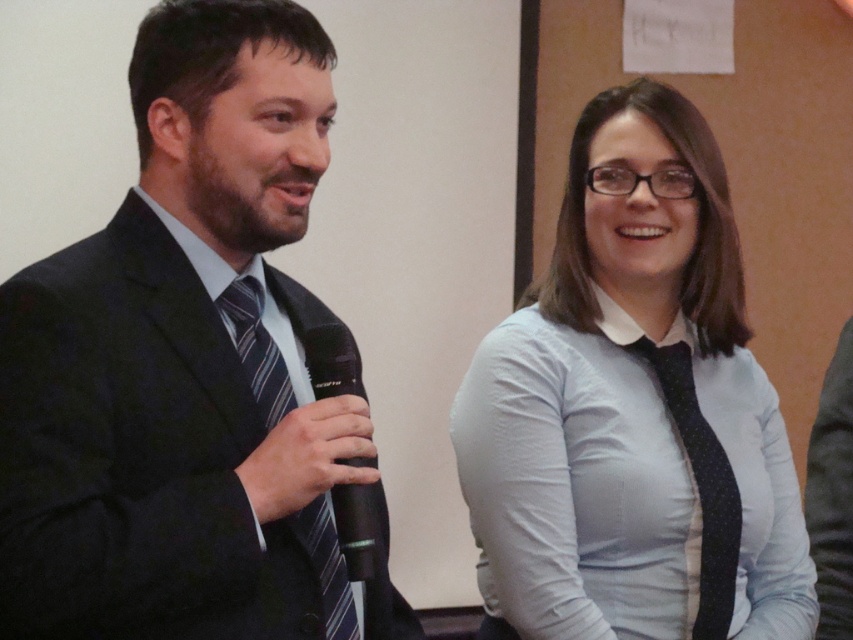
Question: Which object is positioned closest to the black dotted tie at center?

Choices:
 (A) striped fabric tie at left
 (B) light blue shirt at center
 (C) black plastic microphone at center
 (D) matte black suit at left

Answer: (B)

Question: Considering the real-world distances, which object is farthest from the light blue shirt at center?

Choices:
 (A) black plastic microphone at center
 (B) striped fabric tie at left
 (C) matte black suit at left

Answer: (B)

Question: Is matte black suit at left to the left of light blue shirt at center from the viewer's perspective?

Choices:
 (A) no
 (B) yes

Answer: (B)

Question: Is light blue shirt at center above black dotted tie at center?

Choices:
 (A) no
 (B) yes

Answer: (B)

Question: Which point is farther to the camera?

Choices:
 (A) (653, 436)
 (B) (376, 540)
 (C) (704, 442)
 (D) (317, 515)

Answer: (C)

Question: Can you confirm if matte black suit at left is positioned below black dotted tie at center?

Choices:
 (A) yes
 (B) no

Answer: (B)